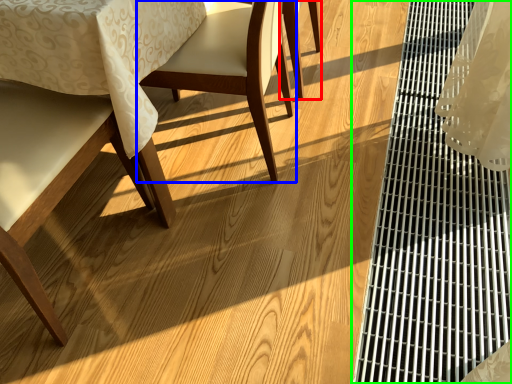
Question: Estimate the real-world distances between objects in this image. Which object is closer to chair (highlighted by a red box), chair (highlighted by a blue box) or table (highlighted by a green box)?

Choices:
 (A) chair
 (B) table

Answer: (A)